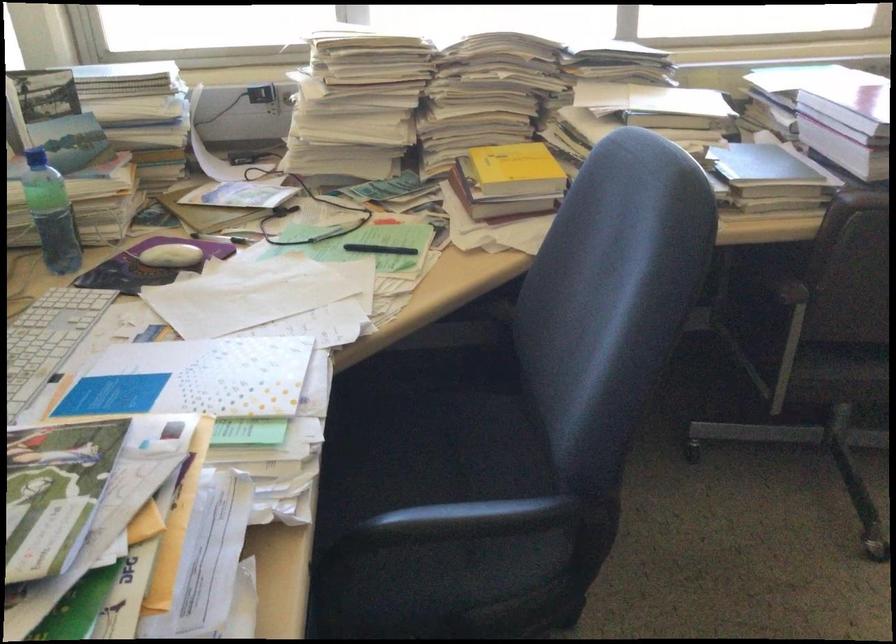
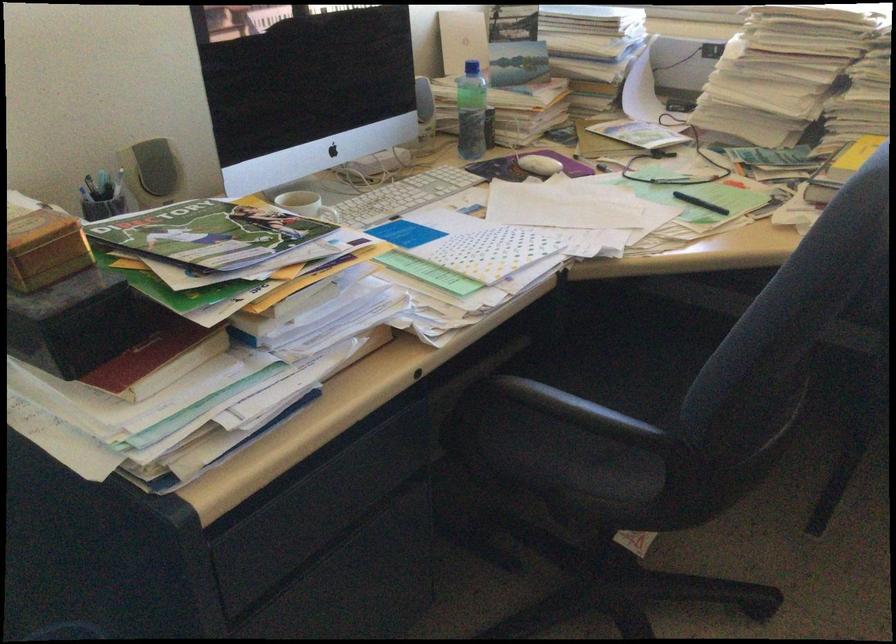
Where in the second image is the point corresponding to pixel 380 252 from the first image?

(700, 203)